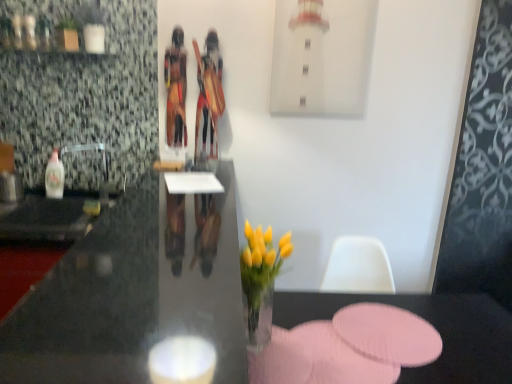
Measure the distance between pink fabric placemat at lower center and camera.

The distance of pink fabric placemat at lower center from camera is 4.21 feet.

The width and height of the screenshot is (512, 384). I want to click on wooden tribal figure at center, the second person positioned from the right, so click(x=176, y=90).

From the image's perspective, which is below, pink fabric placemat at lower center or translucent plastic bottle at left?

pink fabric placemat at lower center appears lower in the image.

Is pink fabric placemat at lower center to the left of translucent plastic bottle at left from the viewer's perspective?

Incorrect, pink fabric placemat at lower center is not on the left side of translucent plastic bottle at left.

Can you confirm if pink fabric placemat at lower center is shorter than translucent plastic bottle at left?

No.

Relative to translucent plastic bottle at left, is pink fabric placemat at lower center in front or behind?

Clearly, pink fabric placemat at lower center is in front of translucent plastic bottle at left.

Considering the sizes of translucent plastic bottle at left and pink fabric placemat at lower center in the image, is translucent plastic bottle at left taller or shorter than pink fabric placemat at lower center?

Considering their sizes, translucent plastic bottle at left has less height than pink fabric placemat at lower center.

Would you consider translucent plastic bottle at left to be distant from pink fabric placemat at lower center?

Indeed, translucent plastic bottle at left is not near pink fabric placemat at lower center.

Is translucent plastic bottle at left bigger than pink fabric placemat at lower center?

No.

Between translucent plastic bottle at left and pink fabric placemat at lower center, which one appears on the right side from the viewer's perspective?

pink fabric placemat at lower center.

From a real-world perspective, between black glossy desk at center and wooden tribal figure at center, placed as the 1th person when sorted from left to right, who is vertically higher?

wooden tribal figure at center, placed as the 1th person when sorted from left to right.

Is black glossy desk at center located outside wooden tribal figure at center, the second person positioned from the right?

black glossy desk at center lies outside wooden tribal figure at center, the second person positioned from the right,'s area.

Considering the positions of point (71, 382) and point (186, 134), is point (71, 382) closer or farther from the camera than point (186, 134)?

Clearly, point (71, 382) is closer to the camera than point (186, 134).

What's the angular difference between black glossy desk at center and wooden tribal figure at center, placed as the 1th person when sorted from left to right,'s facing directions?

They differ by 1.06 degrees in their facing directions.

Considering the relative positions of translucent plastic bottle at left and wooden tribal figure at center, the second person when ordered from left to right, in the image provided, is translucent plastic bottle at left to the left or to the right of wooden tribal figure at center, the second person when ordered from left to right,?

Based on their positions, translucent plastic bottle at left is located to the left of wooden tribal figure at center, the second person when ordered from left to right.

Considering the positions of point (55, 195) and point (208, 45), is point (55, 195) closer or farther from the camera than point (208, 45)?

Clearly, point (55, 195) is more distant from the camera than point (208, 45).

Can you confirm if translucent plastic bottle at left is shorter than wooden tribal figure at center, the second person when ordered from left to right?

Yes.

Considering the sizes of objects translucent plastic bottle at left and wooden tribal figure at center, which appears as the first person when viewed from the right, in the image provided, who is smaller, translucent plastic bottle at left or wooden tribal figure at center, which appears as the first person when viewed from the right,?

translucent plastic bottle at left.

Which object is further away from the camera taking this photo, wooden tribal figure at center, which appears as the first person when viewed from the right, or pink fabric placemat at lower center?

Positioned behind is wooden tribal figure at center, which appears as the first person when viewed from the right.

In terms of width, does wooden tribal figure at center, the second person when ordered from left to right, look wider or thinner when compared to pink fabric placemat at lower center?

Considering their sizes, wooden tribal figure at center, the second person when ordered from left to right, looks slimmer than pink fabric placemat at lower center.

Is pink fabric placemat at lower center at the back of wooden tribal figure at center, which appears as the first person when viewed from the right?

No, pink fabric placemat at lower center is not at the back of wooden tribal figure at center, which appears as the first person when viewed from the right.

From the image's perspective, is wooden tribal figure at center, the second person when ordered from left to right, positioned above or below pink fabric placemat at lower center?

Clearly, from the image's perspective, wooden tribal figure at center, the second person when ordered from left to right, is above pink fabric placemat at lower center.

Considering the sizes of wooden tribal figure at center, the second person positioned from the right, and pink fabric placemat at lower center in the image, is wooden tribal figure at center, the second person positioned from the right, taller or shorter than pink fabric placemat at lower center?

In the image, wooden tribal figure at center, the second person positioned from the right, appears to be taller than pink fabric placemat at lower center.

Which object is closer to the camera, wooden tribal figure at center, the second person positioned from the right, or pink fabric placemat at lower center?

pink fabric placemat at lower center is in front.

Between wooden tribal figure at center, placed as the 1th person when sorted from left to right, and pink fabric placemat at lower center, which one has smaller width?

wooden tribal figure at center, placed as the 1th person when sorted from left to right, is thinner.

Is wooden tribal figure at center, placed as the 1th person when sorted from left to right, oriented towards pink fabric placemat at lower center?

No, wooden tribal figure at center, placed as the 1th person when sorted from left to right, is not oriented towards pink fabric placemat at lower center.

From the image's perspective, is translucent plastic bottle at left on wooden tribal figure at center, placed as the 1th person when sorted from left to right?

No.

Considering the sizes of objects translucent plastic bottle at left and wooden tribal figure at center, the second person positioned from the right, in the image provided, who is taller, translucent plastic bottle at left or wooden tribal figure at center, the second person positioned from the right,?

wooden tribal figure at center, the second person positioned from the right, is taller.

Is translucent plastic bottle at left directly adjacent to wooden tribal figure at center, the second person positioned from the right?

No, translucent plastic bottle at left is not beside wooden tribal figure at center, the second person positioned from the right.

Looking at this image, can you tell me how much translucent plastic bottle at left and wooden tribal figure at center, placed as the 1th person when sorted from left to right, differ in facing direction?

They differ by 1.86 degrees in their facing directions.

The height and width of the screenshot is (384, 512). I want to click on bottle on the left of pink fabric placemat at lower center, so click(x=54, y=177).

I want to click on bottle above the pink fabric placemat at lower center (from the image's perspective), so point(54,177).

Estimate the real-world distances between objects in this image. Which object is closer to wooden tribal figure at center, which appears as the first person when viewed from the right, translucent plastic bottle at left or pink fabric placemat at lower center?

translucent plastic bottle at left is positioned closer to the anchor wooden tribal figure at center, which appears as the first person when viewed from the right.

When comparing their distances from wooden tribal figure at center, which appears as the first person when viewed from the right, does black glossy desk at center or translucent plastic bottle at left seem further?

black glossy desk at center.

Looking at the image, which one is located further to wooden tribal figure at center, placed as the 1th person when sorted from left to right, pink fabric placemat at lower center or translucent plastic bottle at left?

pink fabric placemat at lower center.

From the image, which object appears to be farther from wooden tribal figure at center, placed as the 1th person when sorted from left to right, translucent plastic bottle at left or black glossy desk at center?

Based on the image, black glossy desk at center appears to be further to wooden tribal figure at center, placed as the 1th person when sorted from left to right.

Estimate the real-world distances between objects in this image. Which object is further from wooden tribal figure at center, the second person positioned from the right, black glossy desk at center or wooden tribal figure at center, which appears as the first person when viewed from the right?

black glossy desk at center is positioned further to the anchor wooden tribal figure at center, the second person positioned from the right.

From the image, which object appears to be nearer to pink fabric placemat at lower center, black glossy desk at center or translucent plastic bottle at left?

black glossy desk at center is positioned closer to the anchor pink fabric placemat at lower center.

Based on their spatial positions, is translucent plastic bottle at left or pink fabric placemat at lower center further from black glossy desk at center?

translucent plastic bottle at left lies further to black glossy desk at center than the other object.

When comparing their distances from pink fabric placemat at lower center, does wooden tribal figure at center, the second person when ordered from left to right, or translucent plastic bottle at left seem closer?

wooden tribal figure at center, the second person when ordered from left to right, is positioned closer to the anchor pink fabric placemat at lower center.

Image resolution: width=512 pixels, height=384 pixels. Find the location of `person between wooden tribal figure at center, the second person positioned from the right, and pink fabric placemat at lower center, in the vertical direction`. person between wooden tribal figure at center, the second person positioned from the right, and pink fabric placemat at lower center, in the vertical direction is located at coordinates (208, 101).

This screenshot has width=512, height=384. Identify the location of table between black glossy desk at center and wooden tribal figure at center, the second person positioned from the right, in the front-back direction. (433, 325).

The image size is (512, 384). In order to click on table between black glossy desk at center and translucent plastic bottle at left from front to back in this screenshot , I will do `click(433, 325)`.

This screenshot has height=384, width=512. What are the coordinates of `person between translucent plastic bottle at left and wooden tribal figure at center, which appears as the first person when viewed from the right, in the horizontal direction` in the screenshot? It's located at (176, 90).